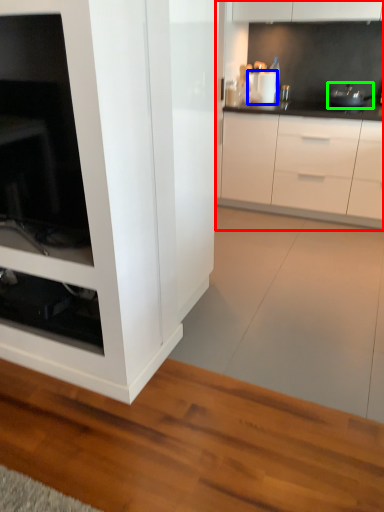
Question: Estimate the real-world distances between objects in this image. Which object is closer to cabinetry (highlighted by a red box), appliance (highlighted by a blue box) or appliance (highlighted by a green box)?

Choices:
 (A) appliance
 (B) appliance

Answer: (B)